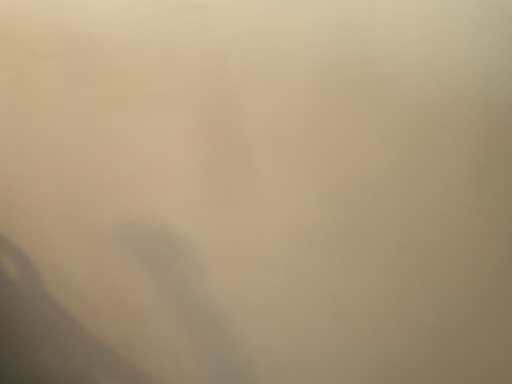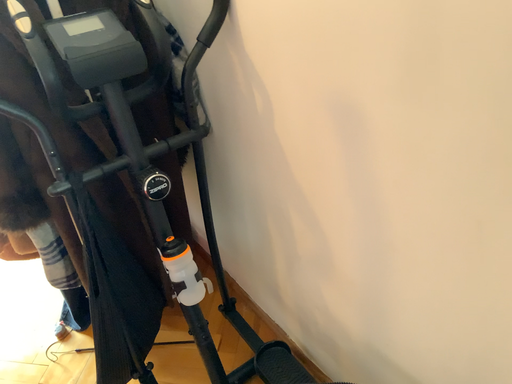
Question: Which way did the camera rotate in the video?

Choices:
 (A) rotated right
 (B) rotated left

Answer: (B)